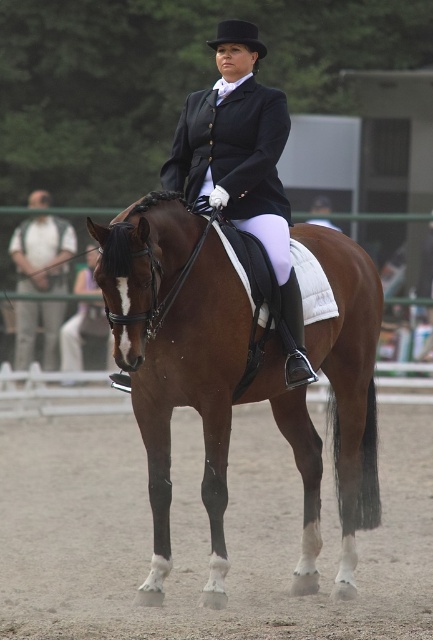
Question: Among these points, which one is farthest from the camera?

Choices:
 (A) (420, 595)
 (B) (274, 182)
 (C) (45, 246)

Answer: (C)

Question: Is brown sandy dirt at center wider than black glossy riding jacket at center?

Choices:
 (A) yes
 (B) no

Answer: (B)

Question: Among these objects, which one is nearest to the camera?

Choices:
 (A) brown sandy dirt at center
 (B) black glossy riding jacket at center
 (C) brown glossy horse at center
 (D) matte black jacket at upper center

Answer: (C)

Question: Can you confirm if brown sandy dirt at center is positioned to the left of black glossy riding jacket at center?

Choices:
 (A) no
 (B) yes

Answer: (B)

Question: Does brown sandy dirt at center appear on the left side of black glossy riding jacket at center?

Choices:
 (A) no
 (B) yes

Answer: (B)

Question: Among these points, which one is nearest to the camera?

Choices:
 (A) (349, 465)
 (B) (31, 248)
 (C) (212, 122)
 (D) (44, 532)

Answer: (A)